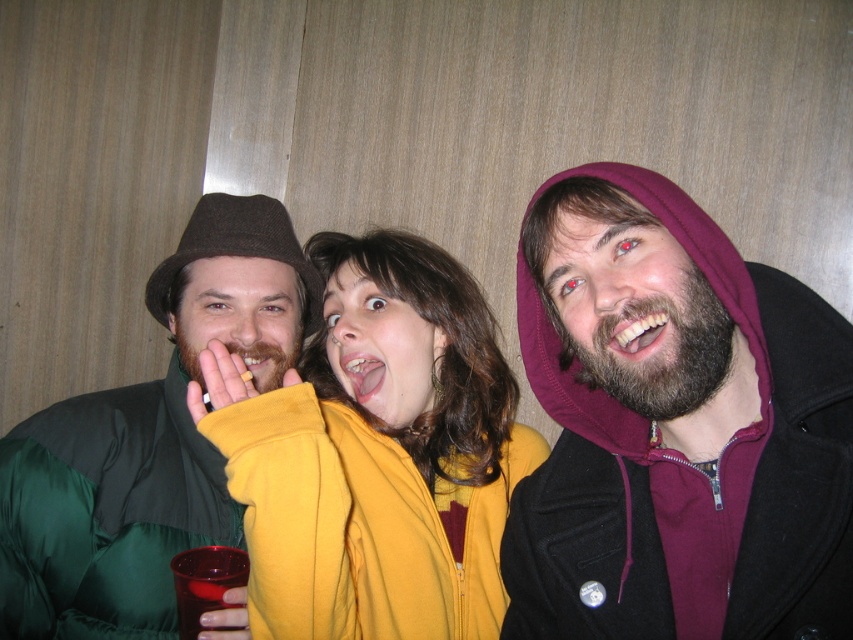
Question: Which object appears farthest from the camera in this image?

Choices:
 (A) green satin jacket at left
 (B) translucent plastic cup at lower left
 (C) matte yellow teeth at center

Answer: (C)

Question: Which point is closer to the camera?

Choices:
 (A) (604, 321)
 (B) (279, 355)
 (C) (373, 381)
 (D) (293, 483)

Answer: (D)

Question: Does maroon hoodie at center have a larger size compared to pink glossy tongue at center?

Choices:
 (A) yes
 (B) no

Answer: (A)

Question: Is smooth white teeth at center positioned behind pink glossy tongue at center?

Choices:
 (A) yes
 (B) no

Answer: (B)

Question: Based on their relative distances, which object is farther from the matte yellow teeth at center?

Choices:
 (A) translucent plastic cup at lower left
 (B) pink glossy tongue at center
 (C) yellow fleece jacket at center

Answer: (A)

Question: Where is smooth white teeth at center located in relation to pink glossy tongue at center in the image?

Choices:
 (A) below
 (B) above

Answer: (B)